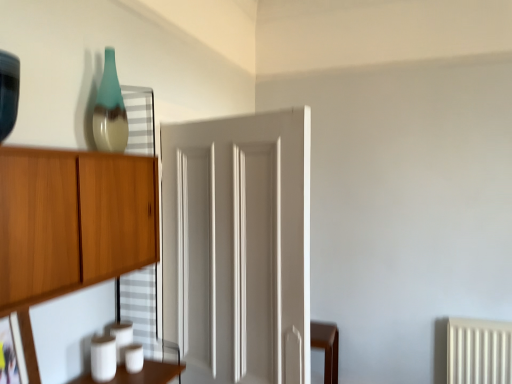
Question: Considering the relative sizes of white painted wood door at center and teal glass vase at upper left in the image provided, is white painted wood door at center taller than teal glass vase at upper left?

Choices:
 (A) no
 (B) yes

Answer: (B)

Question: Is white painted wood door at center completely or partially outside of teal glass vase at upper left?

Choices:
 (A) yes
 (B) no

Answer: (A)

Question: Is white painted wood door at center to the right of teal glass vase at upper left from the viewer's perspective?

Choices:
 (A) no
 (B) yes

Answer: (B)

Question: Is white painted wood door at center in front of teal glass vase at upper left?

Choices:
 (A) yes
 (B) no

Answer: (A)

Question: Would you consider white painted wood door at center to be distant from teal glass vase at upper left?

Choices:
 (A) yes
 (B) no

Answer: (B)

Question: From a real-world perspective, is white painted wood door at center over teal glass vase at upper left?

Choices:
 (A) no
 (B) yes

Answer: (A)

Question: Can you confirm if matte black picture frame at lower left is wider than teal glass vase at upper left?

Choices:
 (A) yes
 (B) no

Answer: (B)

Question: From the image's perspective, is matte black picture frame at lower left under teal glass vase at upper left?

Choices:
 (A) no
 (B) yes

Answer: (B)

Question: Is matte black picture frame at lower left at the right side of teal glass vase at upper left?

Choices:
 (A) yes
 (B) no

Answer: (B)

Question: Is the depth of matte black picture frame at lower left less than that of teal glass vase at upper left?

Choices:
 (A) yes
 (B) no

Answer: (A)

Question: Are matte black picture frame at lower left and teal glass vase at upper left making contact?

Choices:
 (A) yes
 (B) no

Answer: (B)

Question: From the image's perspective, is matte black picture frame at lower left over teal glass vase at upper left?

Choices:
 (A) yes
 (B) no

Answer: (B)

Question: Considering the relative positions of matte black picture frame at lower left and white painted wood door at center in the image provided, is matte black picture frame at lower left behind white painted wood door at center?

Choices:
 (A) no
 (B) yes

Answer: (A)